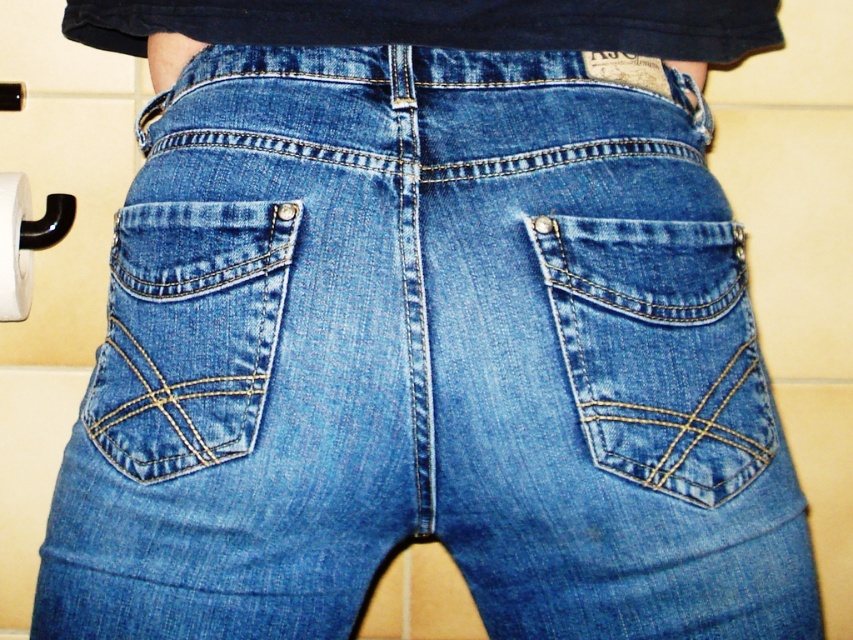
Question: Can you confirm if denim blue jeans pocket at lower left is positioned to the right of white matte toilet paper at lower left?

Choices:
 (A) yes
 (B) no

Answer: (A)

Question: Among these points, which one is farthest from the camera?

Choices:
 (A) (0, 230)
 (B) (18, 236)

Answer: (B)

Question: Among these points, which one is farthest from the camera?

Choices:
 (A) (136, 445)
 (B) (723, 324)

Answer: (B)

Question: Is white matte toilet paper at lower left behind white paper roll at lower left?

Choices:
 (A) no
 (B) yes

Answer: (B)

Question: Which object is positioned closest to the denim/jeans pocket at center?

Choices:
 (A) white matte toilet paper at lower left
 (B) white paper roll at lower left

Answer: (A)

Question: Does white matte toilet paper at lower left come behind white paper roll at lower left?

Choices:
 (A) yes
 (B) no

Answer: (A)